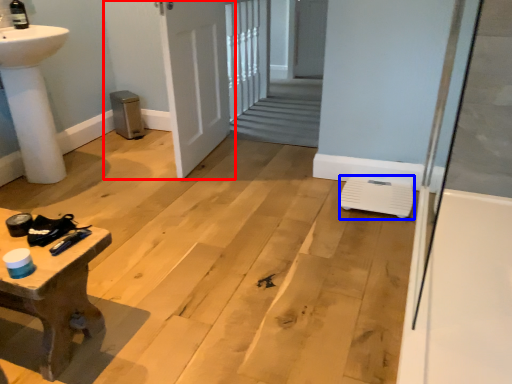
Question: Among these objects, which one is nearest to the camera, door (highlighted by a red box) or water heater (highlighted by a blue box)?

Choices:
 (A) door
 (B) water heater

Answer: (B)